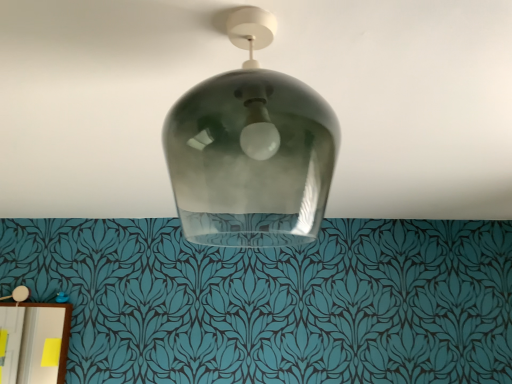
What do you see at coordinates (18, 294) in the screenshot? I see `matte white lampshade at lower left, which is counted as the 2th lamp, starting from the front` at bounding box center [18, 294].

Identify the location of matte white lampshade at lower left, marked as the second lamp in a top-to-bottom arrangement. The image size is (512, 384). (18, 294).

In order to click on matte white lampshade at lower left, marked as the second lamp in a top-to-bottom arrangement in this screenshot , I will do `click(18, 294)`.

Based on the photo, can you tell me how much matte white lampshade at lower left, the first lamp in the bottom-to-top sequence, and transparent glass light fixture at center differ in facing direction?

The facing directions of matte white lampshade at lower left, the first lamp in the bottom-to-top sequence, and transparent glass light fixture at center are 88.8 degrees apart.

Would you say matte white lampshade at lower left, the first lamp from the back, is outside transparent glass light fixture at center?

Yes, matte white lampshade at lower left, the first lamp from the back, is located beyond the bounds of transparent glass light fixture at center.

There is a transparent glass light fixture at center. Where is `the 2nd lamp below it (from a real-world perspective)`? The image size is (512, 384). the 2nd lamp below it (from a real-world perspective) is located at coordinates (18, 294).

Which object is further away from the camera taking this photo, matte white lampshade at lower left, which is counted as the 2th lamp, starting from the right, or transparent glass light fixture at center?

matte white lampshade at lower left, which is counted as the 2th lamp, starting from the right, is behind.

Is smoke glass lampshade at center, marked as the second lamp in a left-to-right arrangement, closer to camera compared to transparent glass light fixture at center?

Yes, smoke glass lampshade at center, marked as the second lamp in a left-to-right arrangement, is in front of transparent glass light fixture at center.

From a real-world perspective, is smoke glass lampshade at center, marked as the second lamp in a left-to-right arrangement, over transparent glass light fixture at center?

No, from a real-world perspective, smoke glass lampshade at center, marked as the second lamp in a left-to-right arrangement, is not above transparent glass light fixture at center.

Which point is more forward, (205, 163) or (378, 159)?

The point (205, 163) is closer to the camera.

From a real-world perspective, starting from the transparent glass light fixture at center, which lamp is the 1st one below it? Please provide its 2D coordinates.

[(251, 150)]

Who is smaller, matte white lampshade at lower left, marked as the second lamp in a top-to-bottom arrangement, or smoke glass lampshade at center, acting as the first lamp starting from the top?

matte white lampshade at lower left, marked as the second lamp in a top-to-bottom arrangement.

From the image's perspective, which is below, matte white lampshade at lower left, the first lamp in the bottom-to-top sequence, or smoke glass lampshade at center, which ranks as the 2th lamp in back-to-front order?

matte white lampshade at lower left, the first lamp in the bottom-to-top sequence, from the image's perspective.

Does matte white lampshade at lower left, the 1th lamp in the left-to-right sequence, have a greater height compared to smoke glass lampshade at center, placed as the 1th lamp when sorted from right to left?

No, matte white lampshade at lower left, the 1th lamp in the left-to-right sequence, is not taller than smoke glass lampshade at center, placed as the 1th lamp when sorted from right to left.

Is matte white lampshade at lower left, which is counted as the 2th lamp, starting from the front, to the right of smoke glass lampshade at center, acting as the first lamp starting from the top, from the viewer's perspective?

No, matte white lampshade at lower left, which is counted as the 2th lamp, starting from the front, is not to the right of smoke glass lampshade at center, acting as the first lamp starting from the top.

Looking at this image, between smoke glass lampshade at center, acting as the first lamp starting from the top, and matte white lampshade at lower left, marked as the second lamp in a top-to-bottom arrangement, which one appears on the right side from the viewer's perspective?

smoke glass lampshade at center, acting as the first lamp starting from the top.

Between smoke glass lampshade at center, which is counted as the second lamp, starting from the bottom, and matte white lampshade at lower left, which is counted as the 2th lamp, starting from the right, which one has smaller width?

Thinner between the two is matte white lampshade at lower left, which is counted as the 2th lamp, starting from the right.

How much distance is there between smoke glass lampshade at center, which is counted as the second lamp, starting from the bottom, and matte white lampshade at lower left, marked as the second lamp in a top-to-bottom arrangement?

smoke glass lampshade at center, which is counted as the second lamp, starting from the bottom, is 1.72 meters away from matte white lampshade at lower left, marked as the second lamp in a top-to-bottom arrangement.

From a real-world perspective, between smoke glass lampshade at center, marked as the second lamp in a left-to-right arrangement, and matte white lampshade at lower left, which is counted as the 2th lamp, starting from the front, who is vertically lower?

matte white lampshade at lower left, which is counted as the 2th lamp, starting from the front.

Is transparent glass light fixture at center far from matte white lampshade at lower left, which is counted as the 2th lamp, starting from the front?

Absolutely, transparent glass light fixture at center is distant from matte white lampshade at lower left, which is counted as the 2th lamp, starting from the front.

Considering the positions of points (464, 147) and (22, 296), is point (464, 147) farther from camera compared to point (22, 296)?

That is False.

From a real-world perspective, between transparent glass light fixture at center and matte white lampshade at lower left, the 1th lamp in the left-to-right sequence, who is vertically higher?

transparent glass light fixture at center is physically above.

Is matte white lampshade at lower left, which is counted as the 2th lamp, starting from the right, at the back of transparent glass light fixture at center?

No, matte white lampshade at lower left, which is counted as the 2th lamp, starting from the right, is not at the back of transparent glass light fixture at center.

Considering the points (503, 218) and (333, 160), which point is behind, point (503, 218) or point (333, 160)?

Point (503, 218)

Choose the correct answer: Is transparent glass light fixture at center inside smoke glass lampshade at center, acting as the first lamp starting from the top, or outside it?

transparent glass light fixture at center is not inside smoke glass lampshade at center, acting as the first lamp starting from the top, it's outside.

Does transparent glass light fixture at center have a larger size compared to smoke glass lampshade at center, acting as the first lamp starting from the top?

Indeed, transparent glass light fixture at center has a larger size compared to smoke glass lampshade at center, acting as the first lamp starting from the top.

From the image's perspective, which lamp is the 2nd one below the transparent glass light fixture at center? Please provide its 2D coordinates.

[(18, 294)]

I want to click on lamp that is in front of the transparent glass light fixture at center, so click(251, 150).

From the image, which object appears to be nearer to transparent glass light fixture at center, smoke glass lampshade at center, which is counted as the second lamp, starting from the bottom, or matte white lampshade at lower left, the 1th lamp in the left-to-right sequence?

The object closer to transparent glass light fixture at center is smoke glass lampshade at center, which is counted as the second lamp, starting from the bottom.

Consider the image. Looking at the image, which one is located closer to smoke glass lampshade at center, which ranks as the 2th lamp in back-to-front order, matte white lampshade at lower left, which is counted as the 2th lamp, starting from the right, or transparent glass light fixture at center?

transparent glass light fixture at center is positioned closer to the anchor smoke glass lampshade at center, which ranks as the 2th lamp in back-to-front order.

From the image, which object appears to be nearer to smoke glass lampshade at center, marked as the second lamp in a left-to-right arrangement, transparent glass light fixture at center or matte white lampshade at lower left, marked as the second lamp in a top-to-bottom arrangement?

transparent glass light fixture at center lies closer to smoke glass lampshade at center, marked as the second lamp in a left-to-right arrangement, than the other object.

Based on their spatial positions, is transparent glass light fixture at center or smoke glass lampshade at center, placed as the 1th lamp when sorted from right to left, further from matte white lampshade at lower left, which is counted as the 2th lamp, starting from the front?

smoke glass lampshade at center, placed as the 1th lamp when sorted from right to left, is further to matte white lampshade at lower left, which is counted as the 2th lamp, starting from the front.

Based on their spatial positions, is smoke glass lampshade at center, which is counted as the second lamp, starting from the bottom, or transparent glass light fixture at center further from matte white lampshade at lower left, which is counted as the 2th lamp, starting from the right?

Among the two, smoke glass lampshade at center, which is counted as the second lamp, starting from the bottom, is located further to matte white lampshade at lower left, which is counted as the 2th lamp, starting from the right.

Based on their spatial positions, is matte white lampshade at lower left, the first lamp from the back, or smoke glass lampshade at center, which ranks as the 2th lamp in back-to-front order, further from transparent glass light fixture at center?

matte white lampshade at lower left, the first lamp from the back.

Identify the location of atmosphere between smoke glass lampshade at center, the first lamp viewed from the front, and matte white lampshade at lower left, marked as the second lamp in a top-to-bottom arrangement, in the front-back direction. The image size is (512, 384). (262, 67).